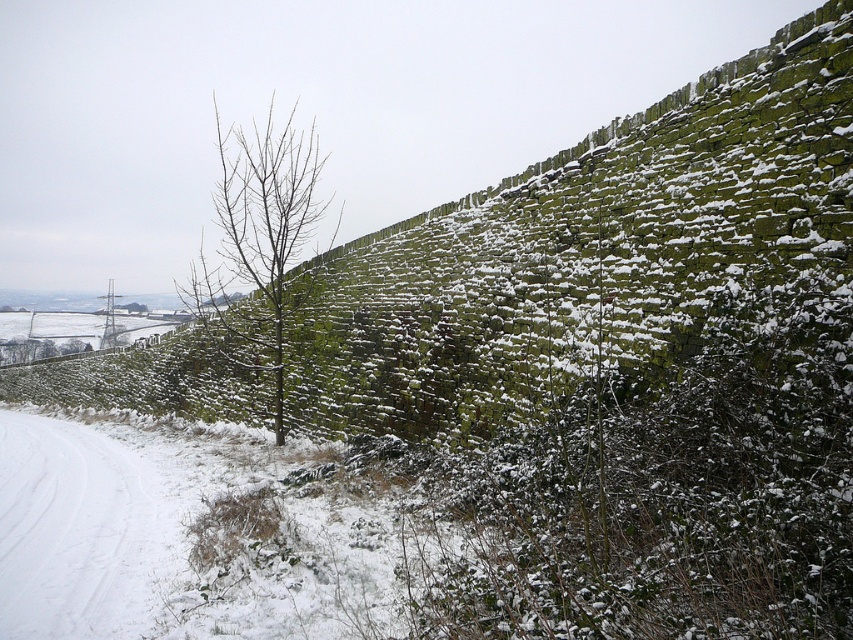
Question: Which point appears farthest from the camera in this image?

Choices:
 (A) (294, 164)
 (B) (836, 448)
 (C) (4, 636)

Answer: (A)

Question: Which of the following is the farthest from the observer?

Choices:
 (A) (59, 433)
 (B) (248, 182)

Answer: (A)

Question: Based on their relative distances, which object is farther from the green mossy hedge at center?

Choices:
 (A) white snow at lower left
 (B) bare branches at center

Answer: (B)

Question: Is white snow at lower left smaller than bare branches at center?

Choices:
 (A) yes
 (B) no

Answer: (A)

Question: Can you confirm if white snow at lower left is positioned above bare branches at center?

Choices:
 (A) no
 (B) yes

Answer: (A)

Question: Does green mossy hedge at center appear on the left side of bare branches at center?

Choices:
 (A) no
 (B) yes

Answer: (A)